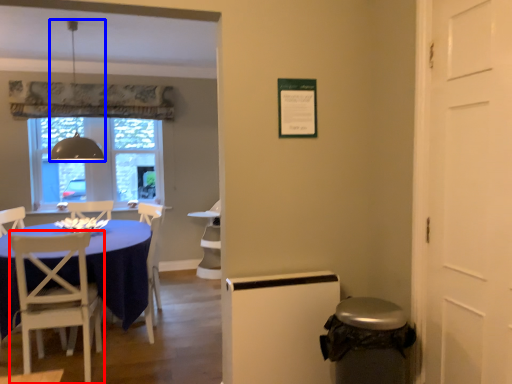
Question: Which object appears closest to the camera in this image, chair (highlighted by a red box) or lamp (highlighted by a blue box)?

Choices:
 (A) chair
 (B) lamp

Answer: (A)